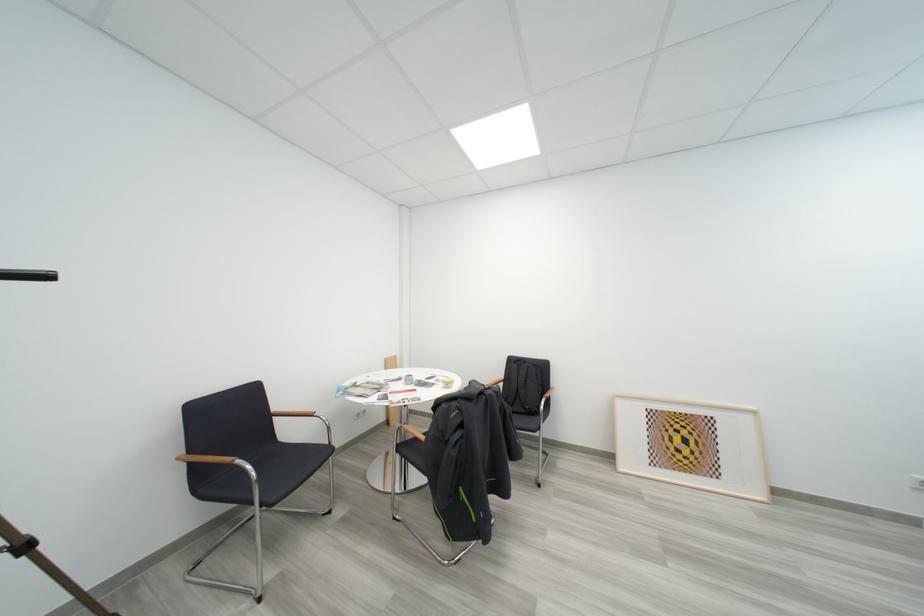
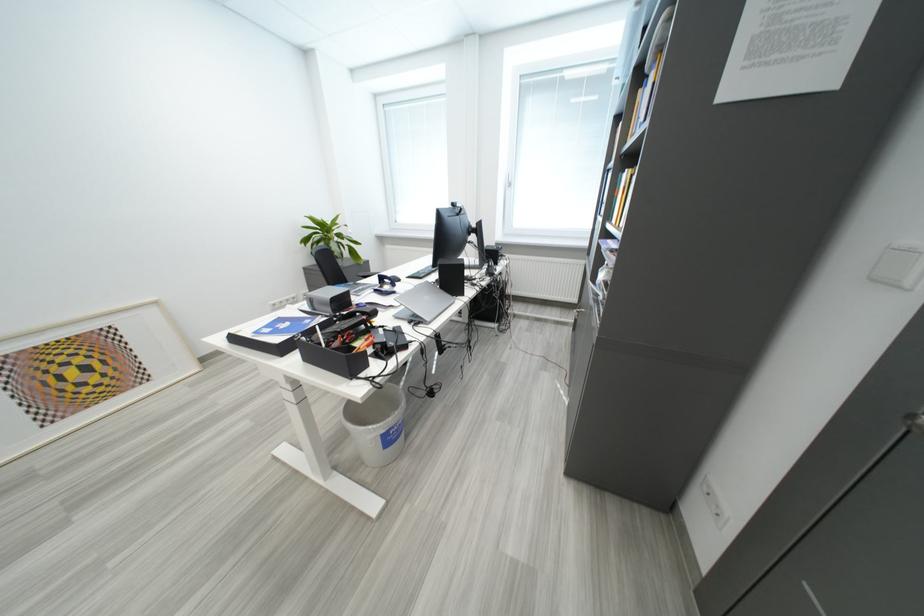
Find the pixel in the second image that matches point 693,435 in the first image.

(88, 363)